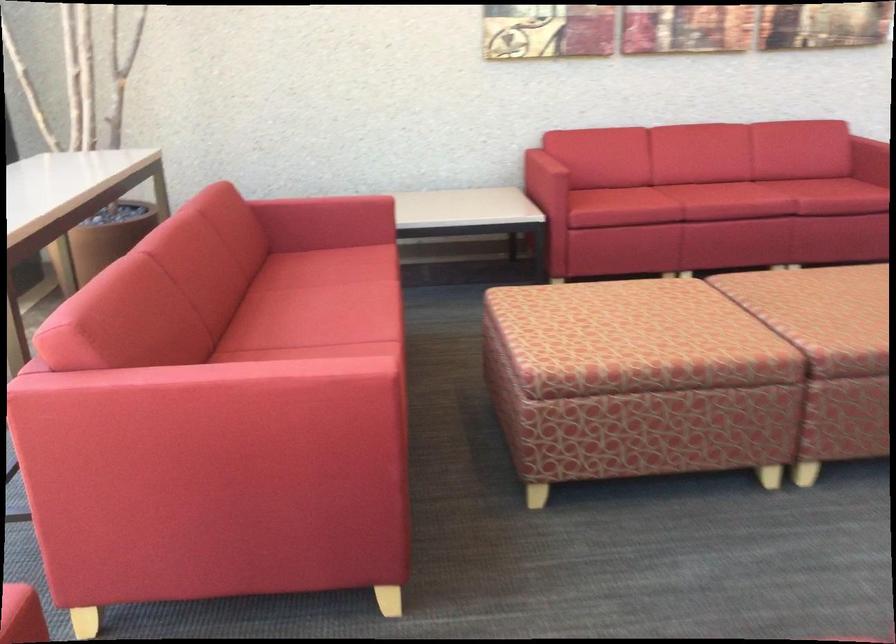
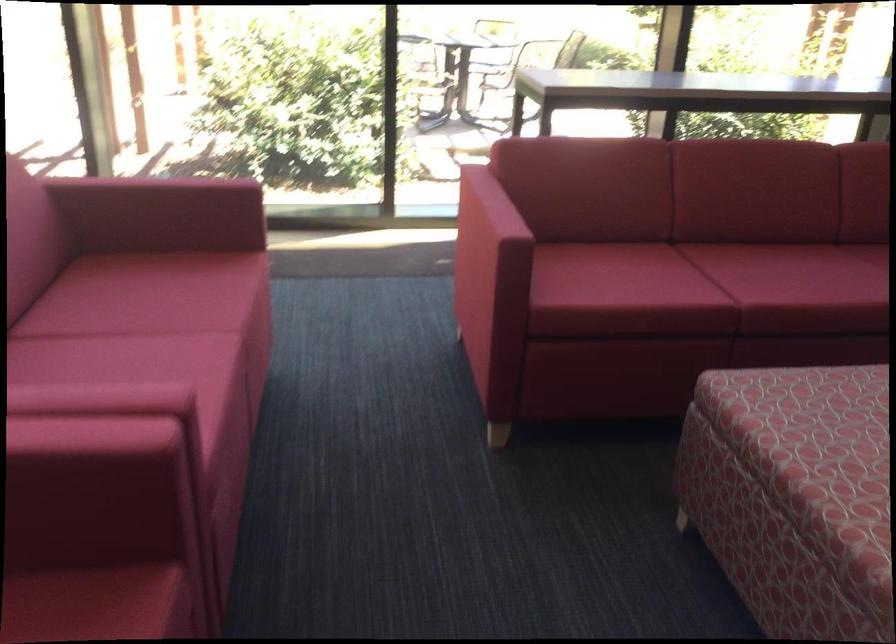
Locate, in the second image, the point that corresponds to point (655, 351) in the first image.

(815, 460)